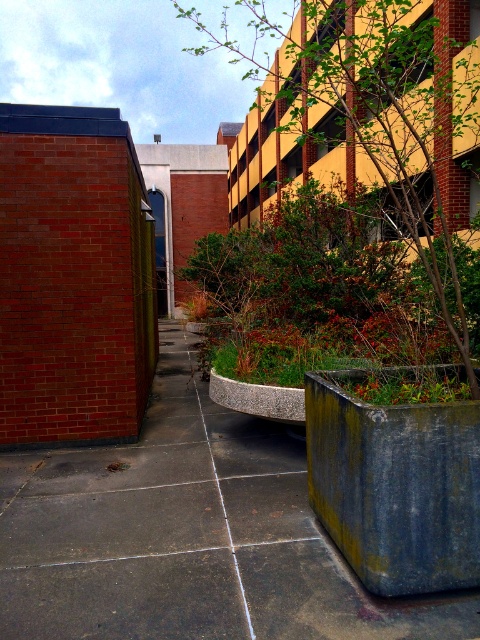
Is concrete pavement at center further to camera compared to green leafy tree at upper center?

No, concrete pavement at center is closer to the viewer.

Between point (36, 556) and point (278, 80), which one is positioned behind?

The point (278, 80) is behind.

Between point (254, 630) and point (412, 124), which one is positioned in front?

Point (254, 630) is more forward.

Locate an element on the screen. The image size is (480, 640). concrete pavement at center is located at coordinates (189, 536).